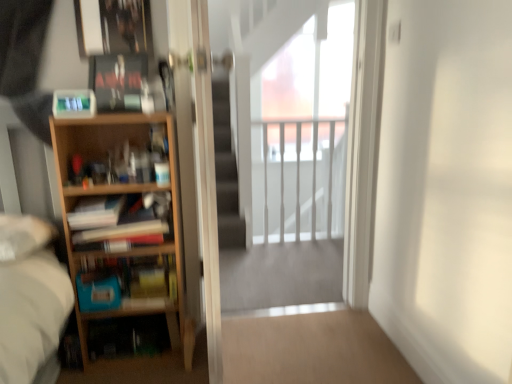
This screenshot has width=512, height=384. What are the coordinates of `free space in front of matte black book at upper left, which is counted as the 1th book, starting from the top` in the screenshot? It's located at (112, 114).